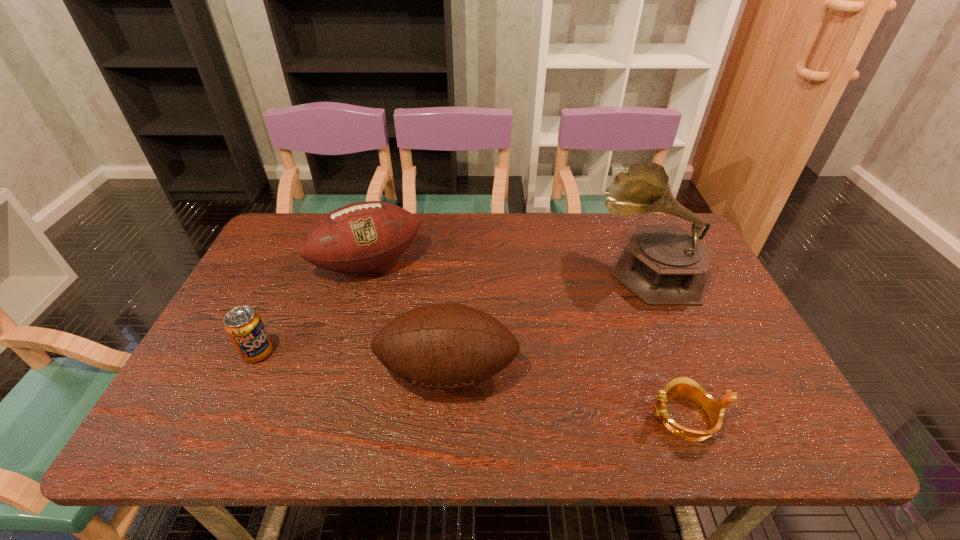
Where is `vacant space that's between the farther football and the phonograph record`? vacant space that's between the farther football and the phonograph record is located at coordinates (510, 267).

Where is `vacant point located between the farther football and the shortest object`? Image resolution: width=960 pixels, height=540 pixels. vacant point located between the farther football and the shortest object is located at coordinates (526, 340).

The height and width of the screenshot is (540, 960). Find the location of `vacant space in between the farther football and the shortest object`. vacant space in between the farther football and the shortest object is located at coordinates (526, 340).

Identify the location of object that stands as the fourth closest to the soda can. The width and height of the screenshot is (960, 540). (681, 387).

Identify which object is the second closest to the farther football. Please provide its 2D coordinates. Your answer should be formatted as a tuple, i.e. [(x, y)], where the tuple contains the x and y coordinates of a point satisfying the conditions above.

[(440, 346)]

At what (x,y) coordinates should I click in order to perform the action: click on free point that satisfies the following two spatial constraints: 1. on the back side of the fourth tallest object; 2. on the right side of the farther football. Please return your answer as a coordinate pair (x, y). Looking at the image, I should click on (300, 264).